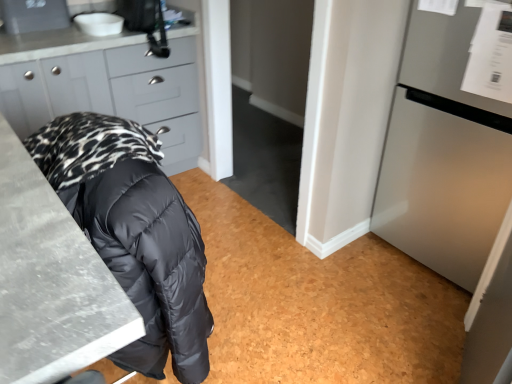
Where is `free location to the left of satin silver refrigerator at right`? Image resolution: width=512 pixels, height=384 pixels. free location to the left of satin silver refrigerator at right is located at coordinates (346, 273).